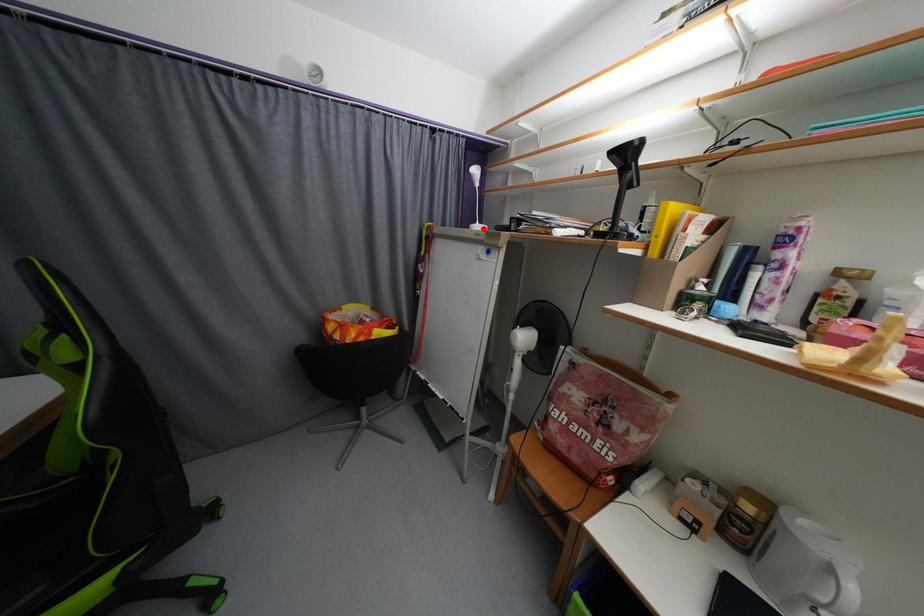
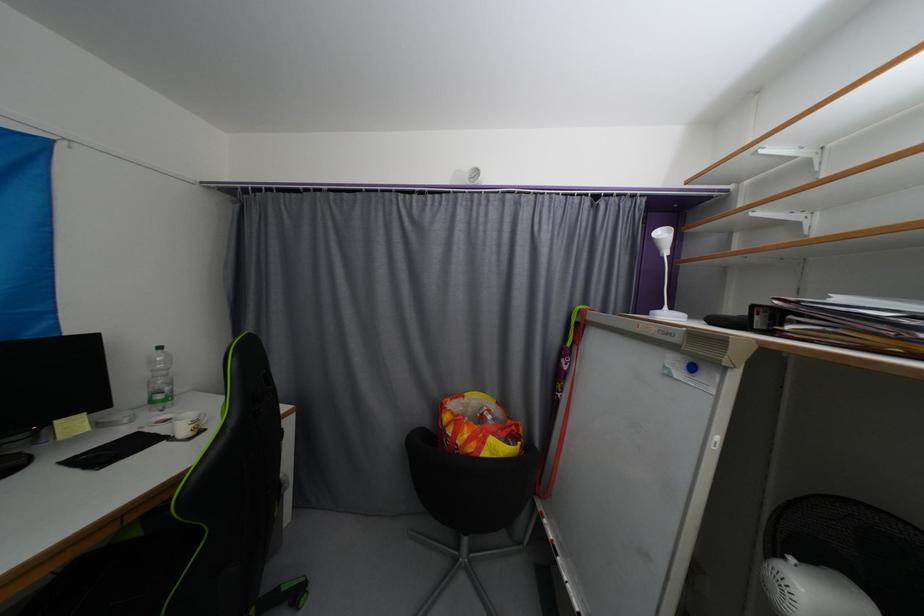
In the second image, find the point that corresponds to the highlighted location in the first image.

(672, 317)